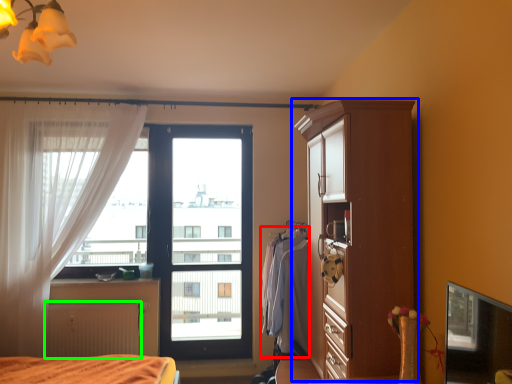
Question: Considering the real-world distances, which object is farthest from clothing (highlighted by a red box)? cupboard (highlighted by a blue box) or radiator (highlighted by a green box)?

Choices:
 (A) cupboard
 (B) radiator

Answer: (B)